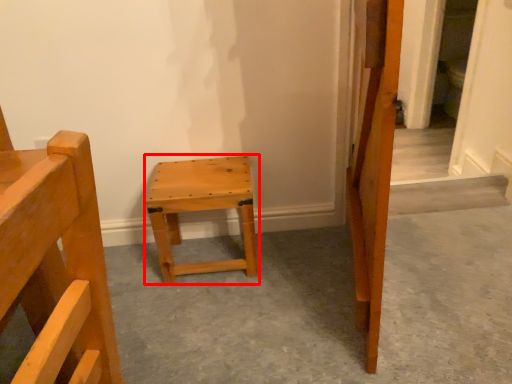
Question: In this image, where is stool (annotated by the red box) located relative to concrete?

Choices:
 (A) right
 (B) left

Answer: (B)